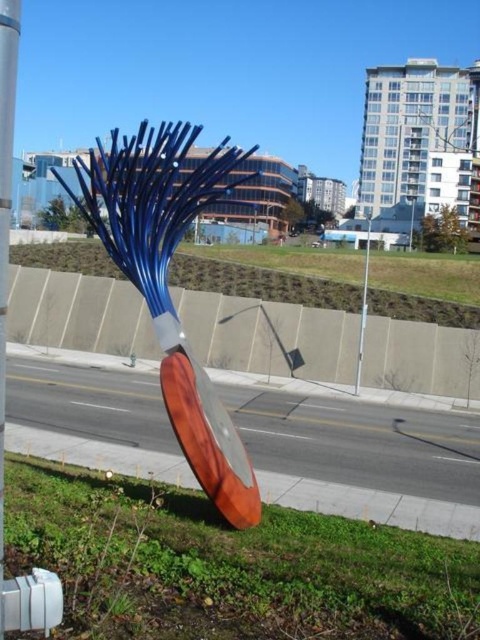
Does point (210, 196) lie in front of point (340, 262)?

Yes, point (210, 196) is in front of point (340, 262).

Can you confirm if shiny blue metal sculpture at center is smaller than green grass at center?

No, shiny blue metal sculpture at center is not smaller than green grass at center.

Find the location of a particular element. The image size is (480, 640). shiny blue metal sculpture at center is located at coordinates (167, 285).

Is green grass at lower center positioned behind green grass at center?

No, green grass at lower center is closer to the viewer.

Find the location of a particular element. green grass at lower center is located at coordinates (231, 564).

Is point (249, 632) farther from viewer compared to point (82, 240)?

No.

I want to click on green grass at lower center, so click(x=231, y=564).

Which is below, green grass at center or smooth silver pole at center?

smooth silver pole at center is lower down.

Can you confirm if green grass at center is taller than smooth silver pole at center?

Correct, green grass at center is much taller as smooth silver pole at center.

Is point (478, 296) less distant than point (6, 164)?

No, (478, 296) is further to viewer.

Find the location of a particular element. green grass at center is located at coordinates (275, 275).